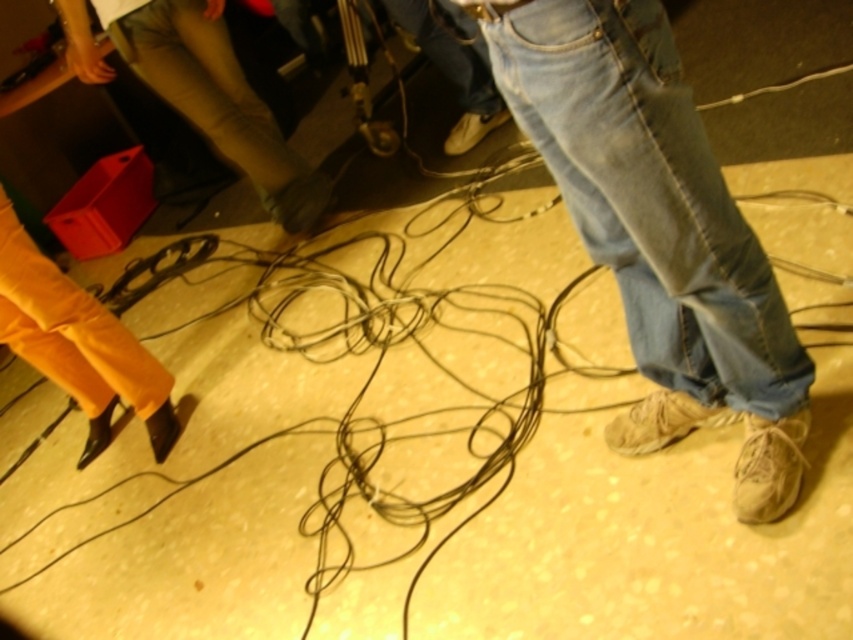
You are trying to navigate through the cluttered floor area shown in the image. There are two points marked on the floor, point (782, 504) and point (190, 67). Which point is closer to you as you stand in front of the image?

Point (782, 504) is closer to the viewer than point (190, 67).

You are trying to avoid stepping on the tangled black cables on the floor. You see the denim jeans at center and the khaki cotton pants at center. Which direction should you move to stay clear of the cables?

You should move to the left side of the khaki cotton pants at center because the denim jeans at center is to the right of khaki cotton pants at center, so moving left would keep you away from the tangled cables.

You are trying to navigate through the cluttered floor with tangled black cables. You see the denim jeans at center. Based on their position, can you estimate how far you should move to your left or right to avoid the cables?

The denim jeans at center is located at point 0.361 on the x and 0.774 on the y. Since the cables are tangled all over the floor, moving either left or right might still encounter cables. However, if you move towards the direction opposite to the jeans, you might find a clearer path. Alternatively, check the area near the orange legs on the left for a possible path.